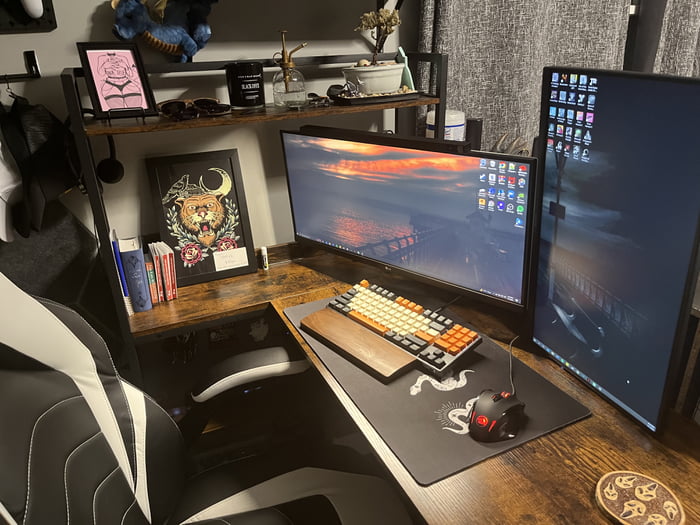
Locate an element on the screen. keyboard is located at coordinates (391, 316).